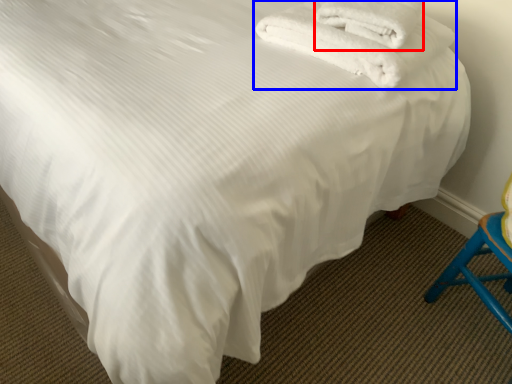
Question: Among these objects, which one is farthest to the camera, towel (highlighted by a red box) or towel (highlighted by a blue box)?

Choices:
 (A) towel
 (B) towel

Answer: (A)